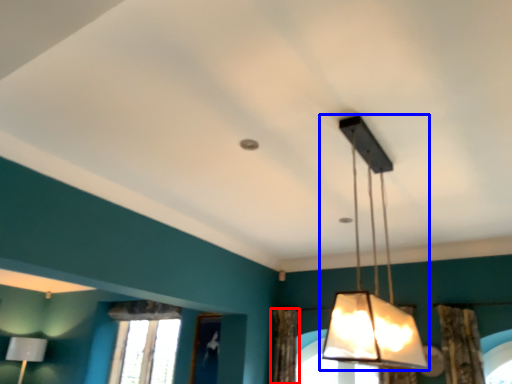
Question: Which of the following is the closest to the observer, curtain (highlighted by a red box) or lamp (highlighted by a blue box)?

Choices:
 (A) curtain
 (B) lamp

Answer: (B)